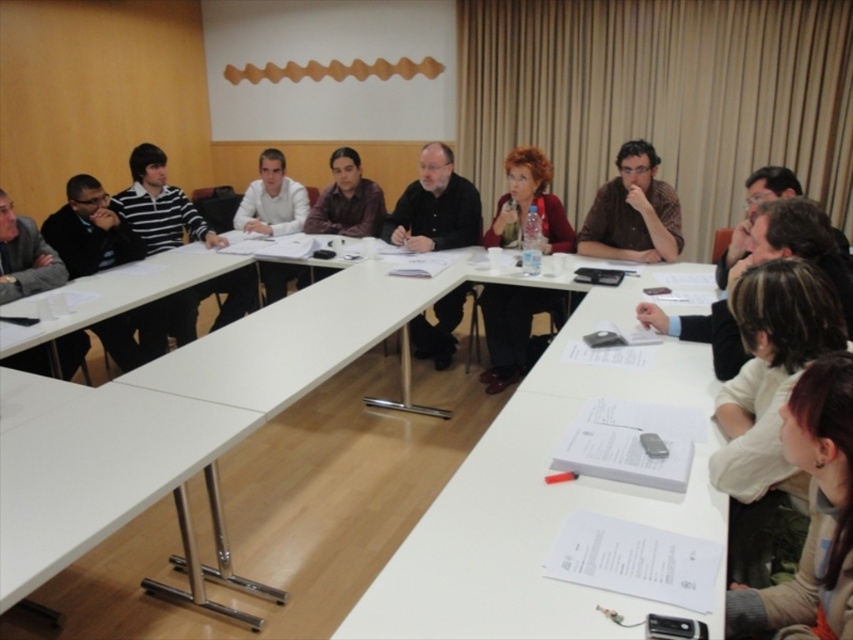
You are attending a meeting and need to identify clothing items based on their sizes. Which clothing item is smaller in size between the white fabric shirt at lower right and the matte red sweater at center?

The white fabric shirt at lower right has a smaller size compared to the matte red sweater at center, so the white fabric shirt at lower right is smaller.

What is located at the point with coordinates (811, 515) in the image?

The white fabric shirt at lower right is located at point (811, 515).

You are standing at the entrance of the conference room and see the point marked at coordinates (97, 474). Which object is this point located on?

The point marked at coordinates (97, 474) is located on the white glossy table at lower left.